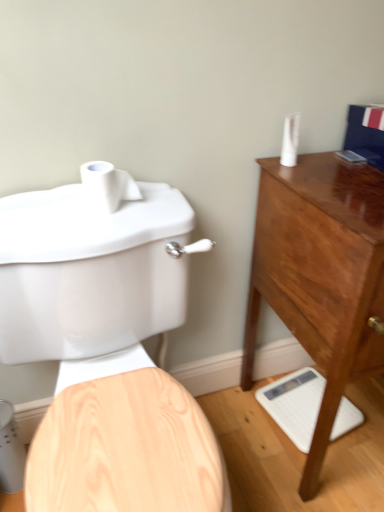
In order to click on free point in front of white plastic toothpaste tube at upper right in this screenshot , I will do `click(326, 181)`.